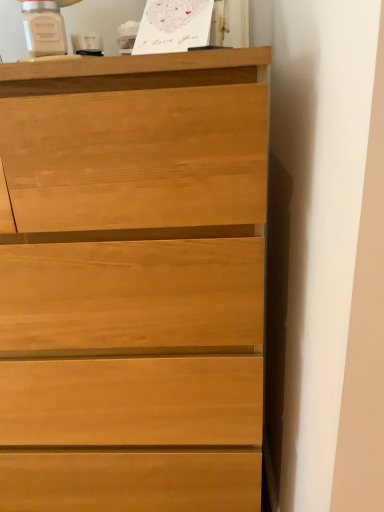
Image resolution: width=384 pixels, height=512 pixels. Describe the element at coordinates (133, 281) in the screenshot. I see `light wood chest of drawers at upper center` at that location.

Find the location of a particular element. light wood chest of drawers at upper center is located at coordinates (133, 281).

Where is `light wood chest of drawers at upper center`? The width and height of the screenshot is (384, 512). light wood chest of drawers at upper center is located at coordinates (133, 281).